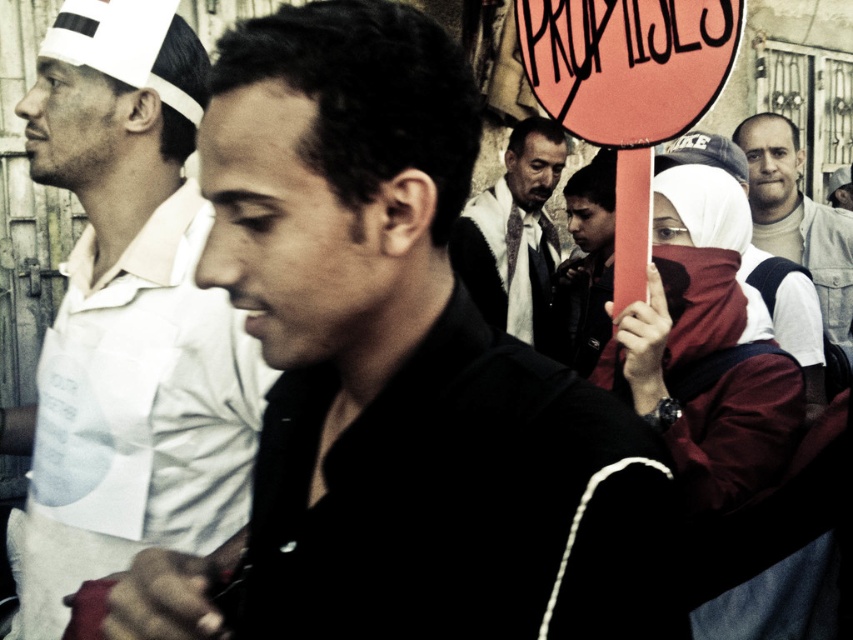
You are a photographer standing at a safe distance. You want to take a clear photo of the black matte shirt at center. Considering the distance, can you capture it clearly with a standard camera lens?

The black matte shirt at center is 43.54 feet away from the viewer. With a standard camera lens, capturing clear details at this distance may be challenging due to the limitations of typical focal lengths. A telephoto lens would be more suitable for clarity at such a distance.

You are a photographer trying to capture the matte red scarf at center and the light brown leather jacket at upper right in the same frame. Based on their positions, which object is closer to the camera?

The matte red scarf at center is below the light brown leather jacket at upper right, so the light brown leather jacket at upper right is closer to the camera.

You are a photographer trying to capture a clear shot of the matte red scarf at center and the light brown leather jacket at upper right. Which object should you zoom in on to ensure it fills the frame without cropping?

The matte red scarf at center is larger in size than the light brown leather jacket at upper right, so you should zoom in on the matte red scarf at center to ensure it fills the frame without cropping.